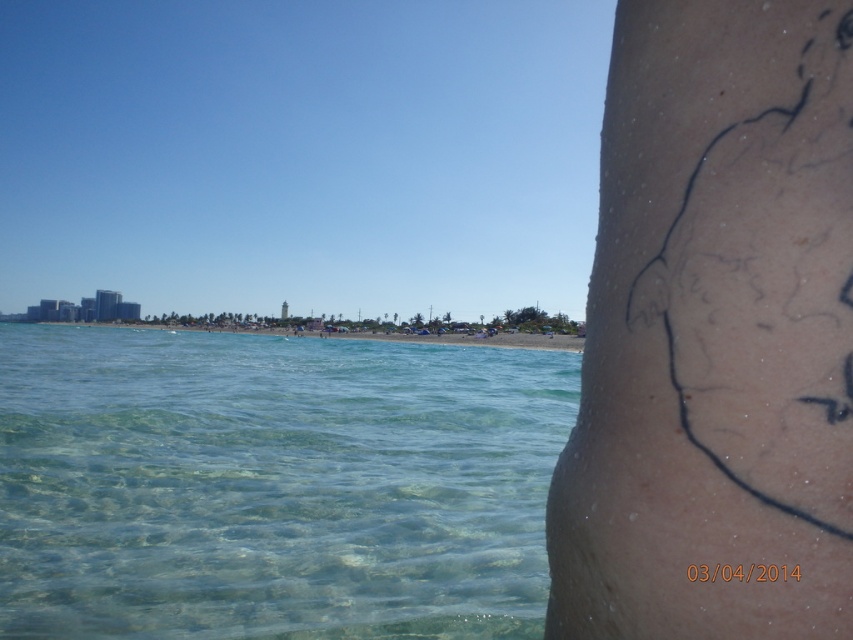
Question: Which object is the closest to the clear water at lower left?

Choices:
 (A) black ink tattoo at right
 (B) smooth sand beach at center
 (C) black ink date at lower right

Answer: (A)

Question: Is smooth sand beach at center wider than black ink date at lower right?

Choices:
 (A) no
 (B) yes

Answer: (B)

Question: Which object appears farthest from the camera in this image?

Choices:
 (A) black ink tattoo at right
 (B) smooth sand beach at center
 (C) clear water at lower left

Answer: (B)

Question: Does clear water at lower left appear on the right side of smooth sand beach at center?

Choices:
 (A) no
 (B) yes

Answer: (B)

Question: Is clear water at lower left wider than black ink date at lower right?

Choices:
 (A) yes
 (B) no

Answer: (A)

Question: Which object is farther from the camera taking this photo?

Choices:
 (A) black ink date at lower right
 (B) smooth sand beach at center

Answer: (B)